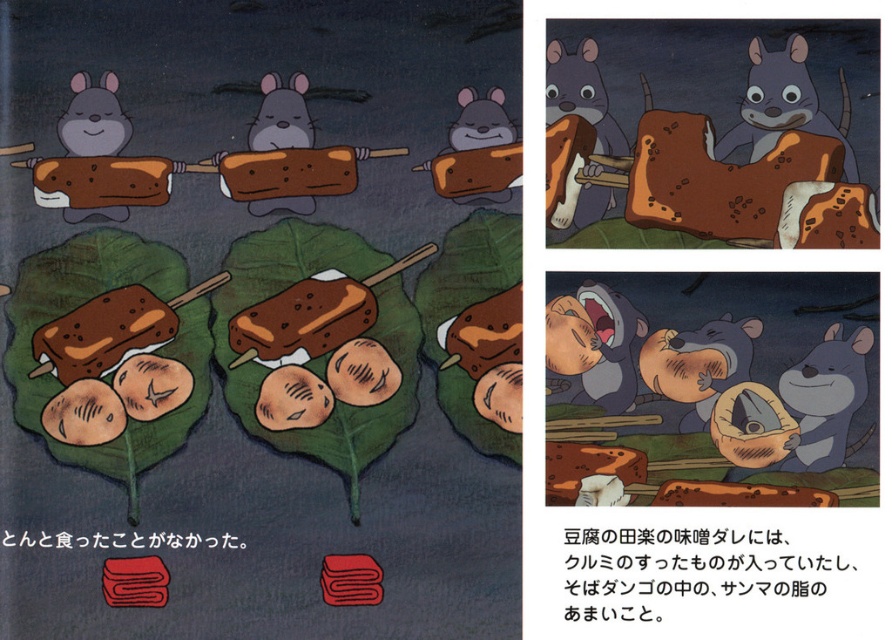
Question: Which point appears closest to the camera in this image?

Choices:
 (A) (793, 35)
 (B) (258, 113)

Answer: (A)

Question: Does brown matte bread at center appear on the left side of gray furry mouse at lower right?

Choices:
 (A) yes
 (B) no

Answer: (A)

Question: Does brown textured bread at upper right come in front of brown matte wood skewer at upper center?

Choices:
 (A) no
 (B) yes

Answer: (B)

Question: Estimate the real-world distances between objects in this image. Which object is closer to the brown matte skewered food at center?

Choices:
 (A) brown textured ice cream at center
 (B) gray matte mouse at upper center
 (C) brown matte skewered food at upper left
 (D) brown matte bread at center

Answer: (C)

Question: Which point is farther to the camera?

Choices:
 (A) brown textured bread at upper right
 (B) gray furry mouse at lower right
 (C) brown matte skewered food at upper left

Answer: (C)

Question: Can you confirm if brown textured bread at upper right is smaller than matte gray mouse at upper left?

Choices:
 (A) yes
 (B) no

Answer: (B)